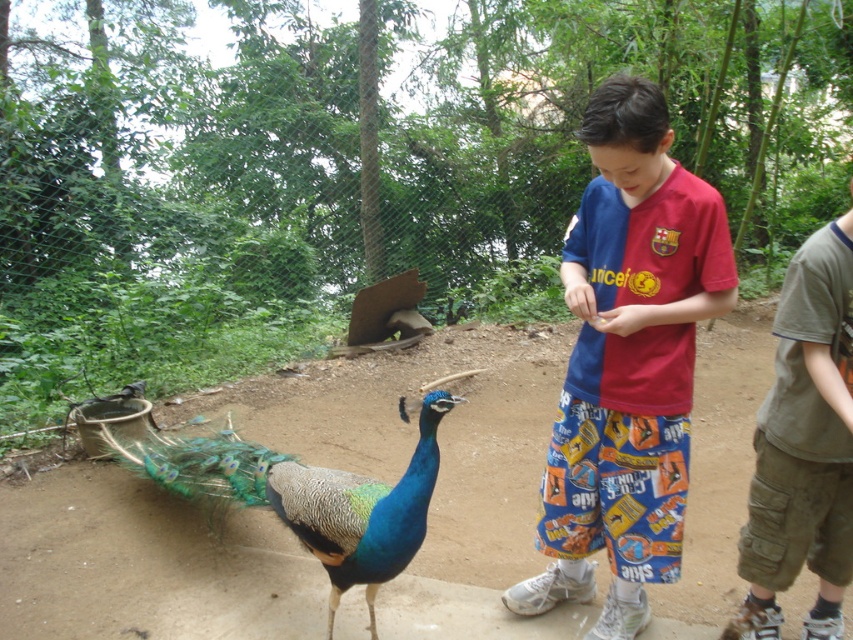
How much distance is there between blue and red jersey at center and blue iridescent feathers at center?

71.13 centimeters

Does blue and red jersey at center have a greater width compared to blue iridescent feathers at center?

No, blue and red jersey at center is not wider than blue iridescent feathers at center.

Who is more distant from viewer, (646, 232) or (233, 461)?

The point (233, 461) is more distant.

Find the location of `blue and red jersey at center`. blue and red jersey at center is located at coordinates (627, 362).

Does blue and red jersey at center appear on the right side of khaki cotton shorts at right?

Incorrect, blue and red jersey at center is not on the right side of khaki cotton shorts at right.

The image size is (853, 640). What do you see at coordinates (627, 362) in the screenshot?
I see `blue and red jersey at center` at bounding box center [627, 362].

Identify the location of blue and red jersey at center. (627, 362).

Is khaki cotton shorts at right further to the viewer compared to blue iridescent feathers at center?

No, it is not.

Can you confirm if khaki cotton shorts at right is thinner than blue iridescent feathers at center?

Yes.

Between point (843, 426) and point (413, 531), which one is positioned behind?

Positioned behind is point (843, 426).

Locate an element on the screen. khaki cotton shorts at right is located at coordinates (804, 445).